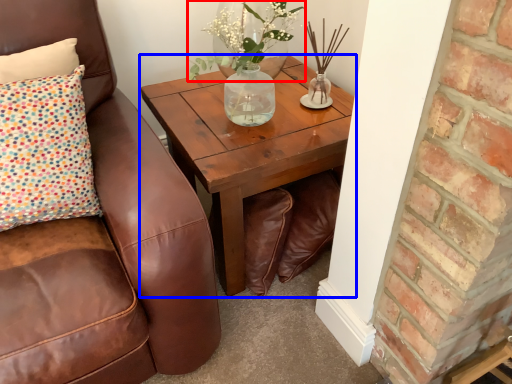
Question: Which of the following is the farthest to the observer, floral arrangement (highlighted by a red box) or coffee table (highlighted by a blue box)?

Choices:
 (A) floral arrangement
 (B) coffee table

Answer: (A)